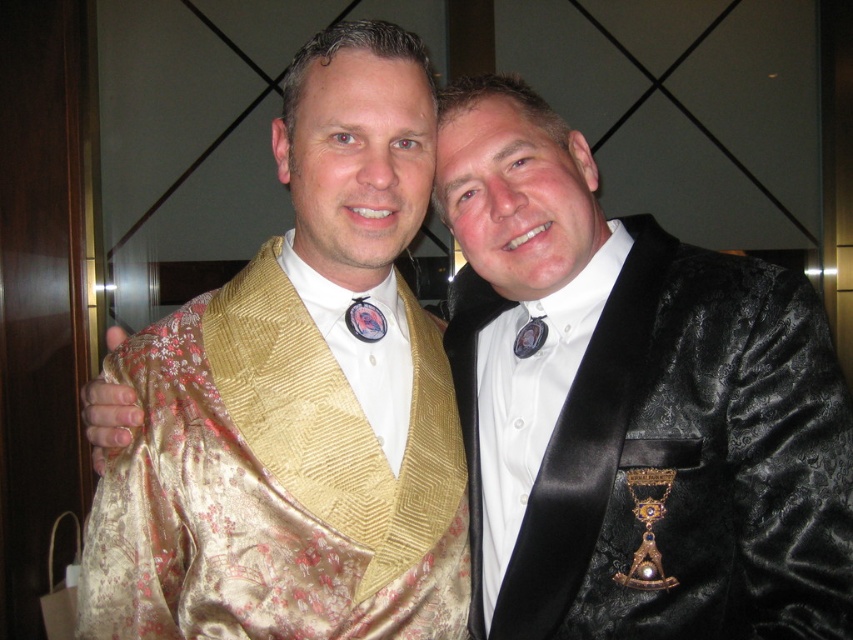
Question: Does gold satin kimono at left have a greater width compared to black velvet suit at right?

Choices:
 (A) yes
 (B) no

Answer: (A)

Question: Which object appears closest to the camera in this image?

Choices:
 (A) gold satin kimono at left
 (B) black velvet suit at right

Answer: (B)

Question: From the image, what is the correct spatial relationship of gold satin kimono at left in relation to black velvet suit at right?

Choices:
 (A) below
 (B) above

Answer: (B)

Question: Does gold satin kimono at left appear on the right side of black velvet suit at right?

Choices:
 (A) no
 (B) yes

Answer: (A)